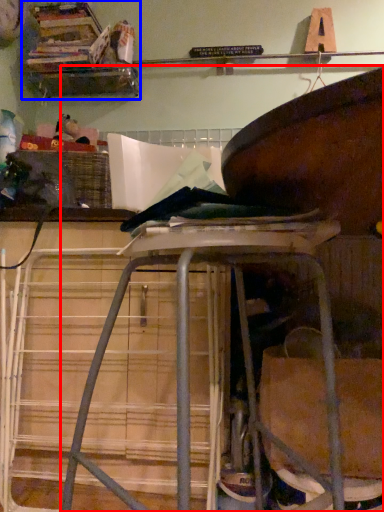
Question: Among these objects, which one is nearest to the camera, furniture (highlighted by a red box) or shelf (highlighted by a blue box)?

Choices:
 (A) furniture
 (B) shelf

Answer: (A)